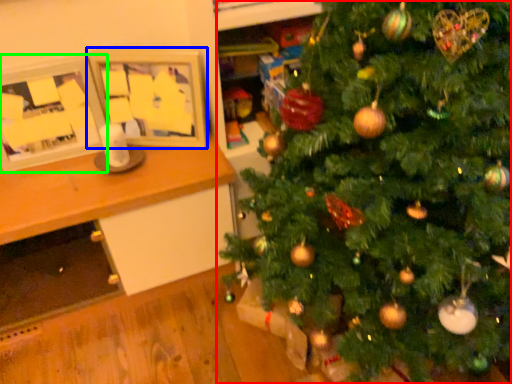
Question: Based on their relative distances, which object is nearer to christmas tree (highlighted by a red box)? Choose from picture frame (highlighted by a blue box) and picture frame (highlighted by a green box).

Choices:
 (A) picture frame
 (B) picture frame

Answer: (A)